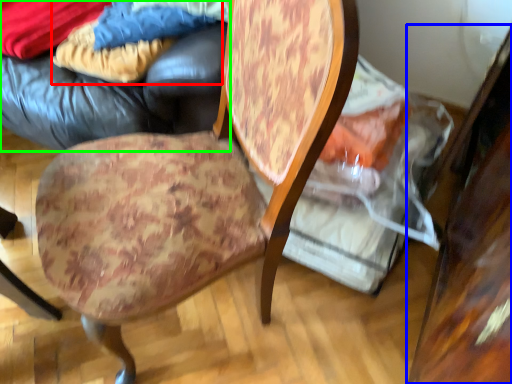
Question: Which object is positioned closest to fabric (highlighted by a red box)? Select from table (highlighted by a blue box) and bean bag chair (highlighted by a green box).

Choices:
 (A) table
 (B) bean bag chair

Answer: (B)